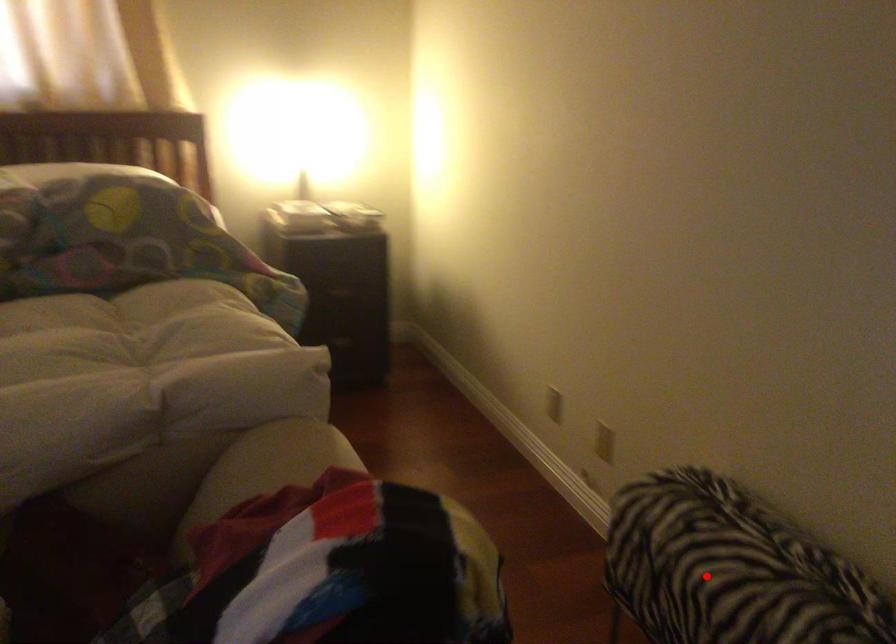
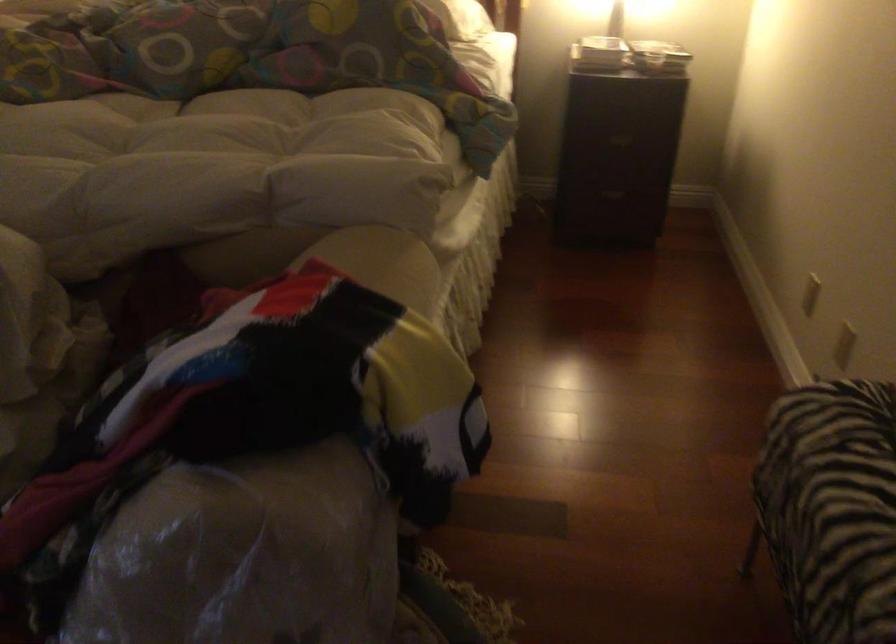
Question: I am providing you with two images of the same scene from different viewpoints. Image1 has a red point marked. In image2, the corresponding 3D location appears at what relative position? Reply with the corresponding letter.

Choices:
 (A) Closer
 (B) Farther

Answer: (A)